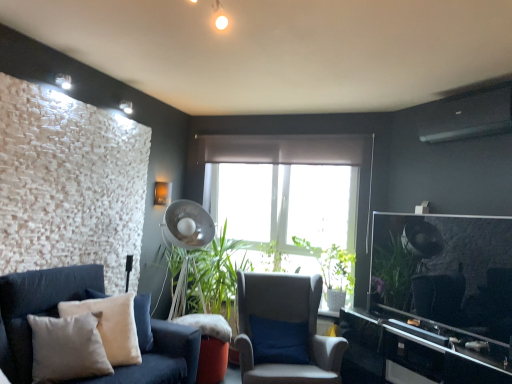
The width and height of the screenshot is (512, 384). I want to click on empty space that is ontop of white sheer curtain at center (from a real-world perspective), so click(x=273, y=131).